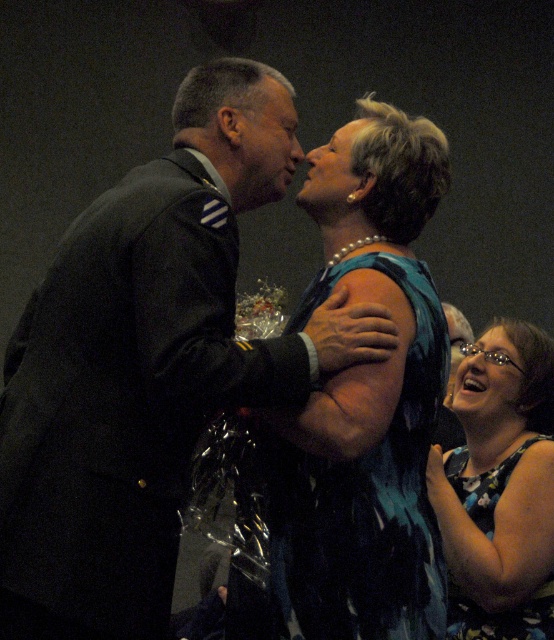
Does matte black face at center appear on the right side of glossy black hair at lower right?

Incorrect, matte black face at center is not on the right side of glossy black hair at lower right.

Is matte black face at center wider than glossy black hair at lower right?

Yes, matte black face at center is wider than glossy black hair at lower right.

What do you see at coordinates (261, 145) in the screenshot? The height and width of the screenshot is (640, 554). I see `matte black face at center` at bounding box center [261, 145].

Where is `matte black face at center`? The image size is (554, 640). matte black face at center is located at coordinates (261, 145).

The height and width of the screenshot is (640, 554). What do you see at coordinates (140, 380) in the screenshot? I see `dark gray suit at center` at bounding box center [140, 380].

Does dark gray suit at center have a lesser width compared to pearl necklace at upper center?

In fact, dark gray suit at center might be wider than pearl necklace at upper center.

Which is behind, point (150, 525) or point (347, 140)?

Point (347, 140)

At what (x,y) coordinates should I click in order to perform the action: click on dark gray suit at center. Please return your answer as a coordinate pair (x, y). Looking at the image, I should click on (140, 380).

Does dark gray suit at center have a lesser width compared to glossy black hair at lower right?

Incorrect, dark gray suit at center's width is not less than glossy black hair at lower right's.

Is point (101, 500) positioned behind point (474, 410)?

No.

Who is more distant from viewer, (120, 536) or (459, 376)?

Point (459, 376)

The image size is (554, 640). What are the coordinates of `dark gray suit at center` in the screenshot? It's located at (140, 380).